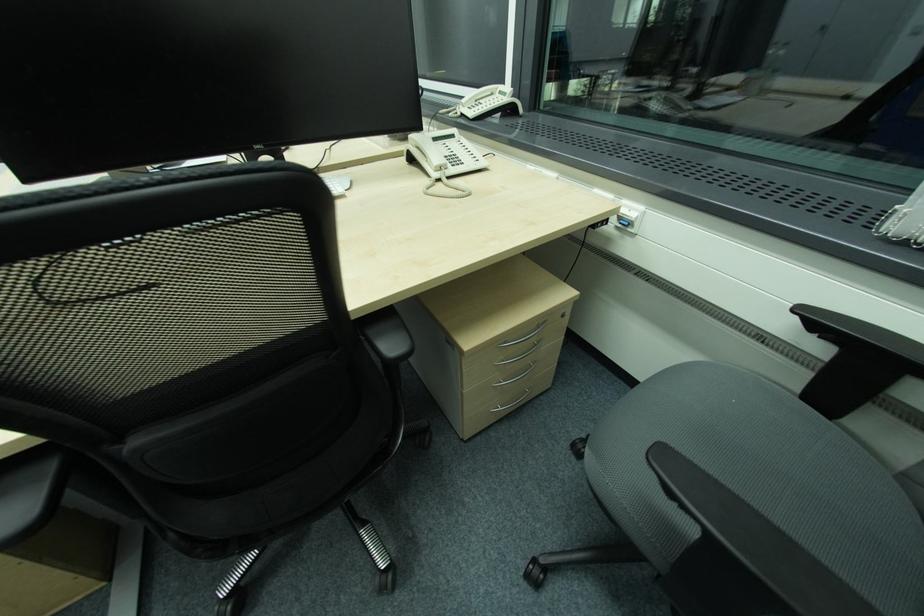
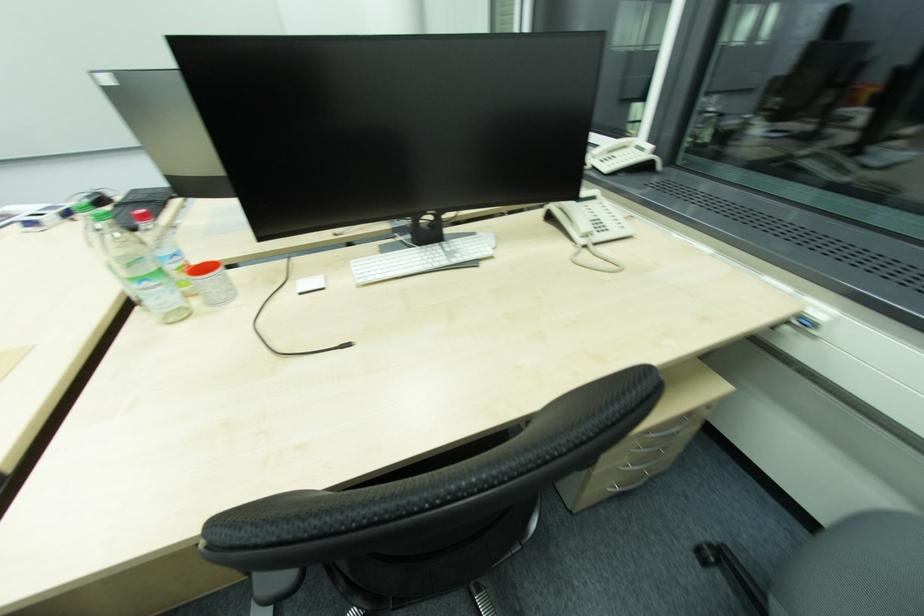
Question: In a continuous first-person perspective shot, in which direction is the camera moving?

Choices:
 (A) Left
 (B) Right
 (C) Forward
 (D) Backward

Answer: (A)